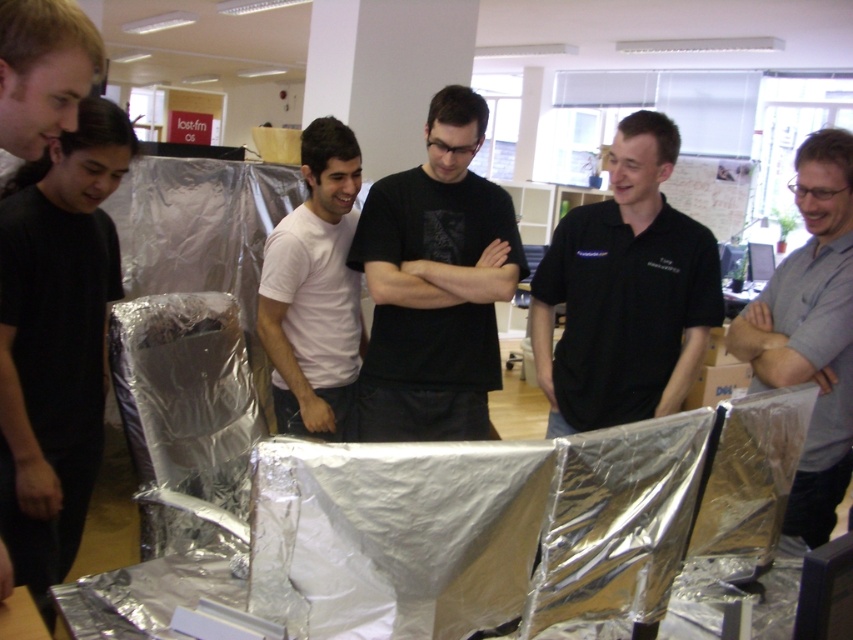
Looking at this image, is black matte t-shirt at left positioned before gray matte shirt at center?

Yes, black matte t-shirt at left is closer to the viewer.

Is point (51, 344) positioned before point (799, 280)?

That is True.

At what (x,y) coordinates should I click in order to perform the action: click on black matte t-shirt at left. Please return your answer as a coordinate pair (x, y). Looking at the image, I should click on coord(56,339).

Between black matte t-shirt at center and gray matte shirt at center, which one appears on the left side from the viewer's perspective?

black matte t-shirt at center is more to the left.

Can you confirm if black matte t-shirt at center is positioned to the right of gray matte shirt at center?

In fact, black matte t-shirt at center is to the left of gray matte shirt at center.

Does point (506, 221) come closer to viewer compared to point (836, 218)?

No, it is behind (836, 218).

The image size is (853, 640). In order to click on black matte t-shirt at center in this screenshot , I will do `click(434, 284)`.

Is black matte t-shirt at left smaller than black matte t-shirt at center?

Yes, black matte t-shirt at left is smaller than black matte t-shirt at center.

Is black matte t-shirt at left shorter than black matte t-shirt at center?

No, black matte t-shirt at left is not shorter than black matte t-shirt at center.

The image size is (853, 640). Describe the element at coordinates (56, 339) in the screenshot. I see `black matte t-shirt at left` at that location.

Locate an element on the screen. The width and height of the screenshot is (853, 640). black matte t-shirt at left is located at coordinates (56, 339).